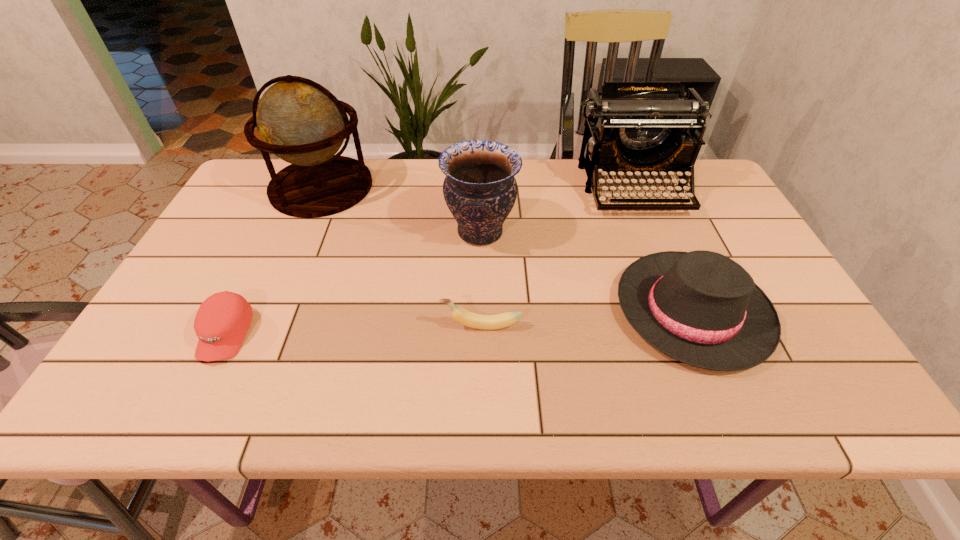
Identify the location of cap located in the left edge section of the desktop. The height and width of the screenshot is (540, 960). (221, 323).

The height and width of the screenshot is (540, 960). I want to click on typewriter that is positioned at the right edge, so click(x=635, y=127).

Where is `dress hat that is at the right edge`? dress hat that is at the right edge is located at coordinates (701, 308).

Identify the location of object at the far left corner. This screenshot has height=540, width=960. (300, 121).

The width and height of the screenshot is (960, 540). I want to click on object present at the far right corner, so click(635, 127).

At what (x,y) coordinates should I click in order to perform the action: click on object that is at the near right corner. Please return your answer as a coordinate pair (x, y). Looking at the image, I should click on (701, 308).

In the image, there is a desktop. Find the location of `vacant space at the far edge`. vacant space at the far edge is located at coordinates (554, 159).

This screenshot has width=960, height=540. What are the coordinates of `vacant space at the near edge of the desktop` in the screenshot? It's located at (389, 404).

At what (x,y) coordinates should I click in order to perform the action: click on vacant area at the left edge. Please return your answer as a coordinate pair (x, y). The image size is (960, 540). Looking at the image, I should click on pos(241,285).

I want to click on free point at the right edge, so click(751, 265).